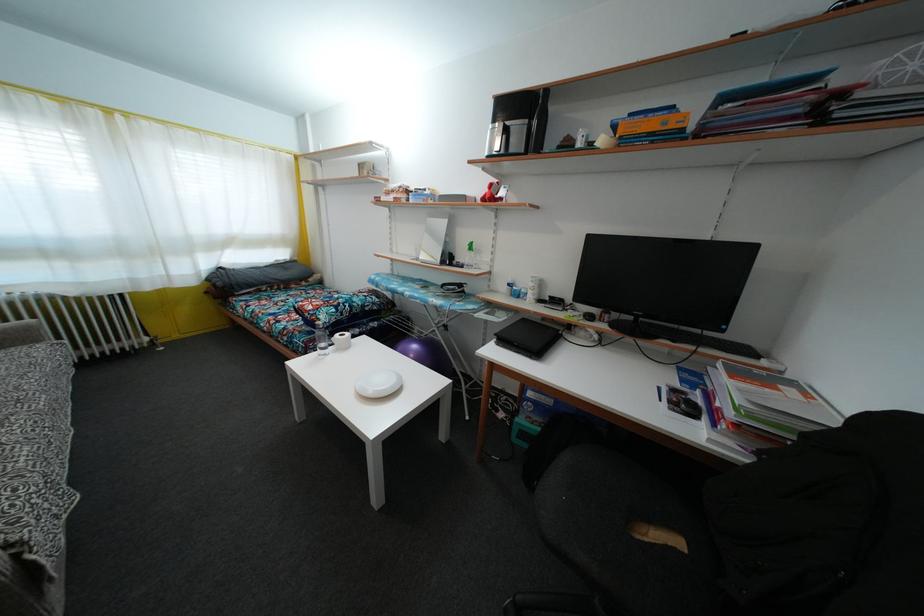
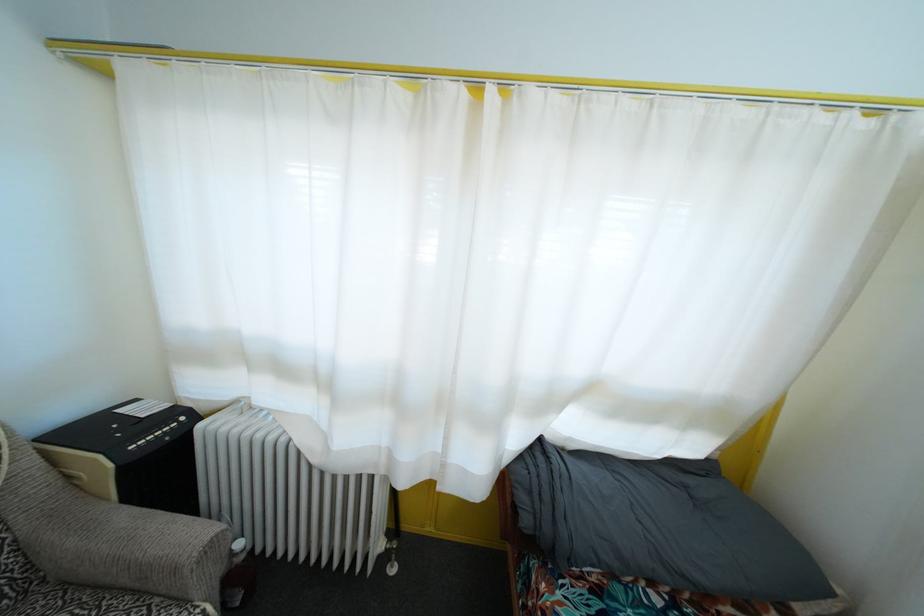
Find the pixel in the second image that matches pixel 224 291 in the first image.

(529, 528)